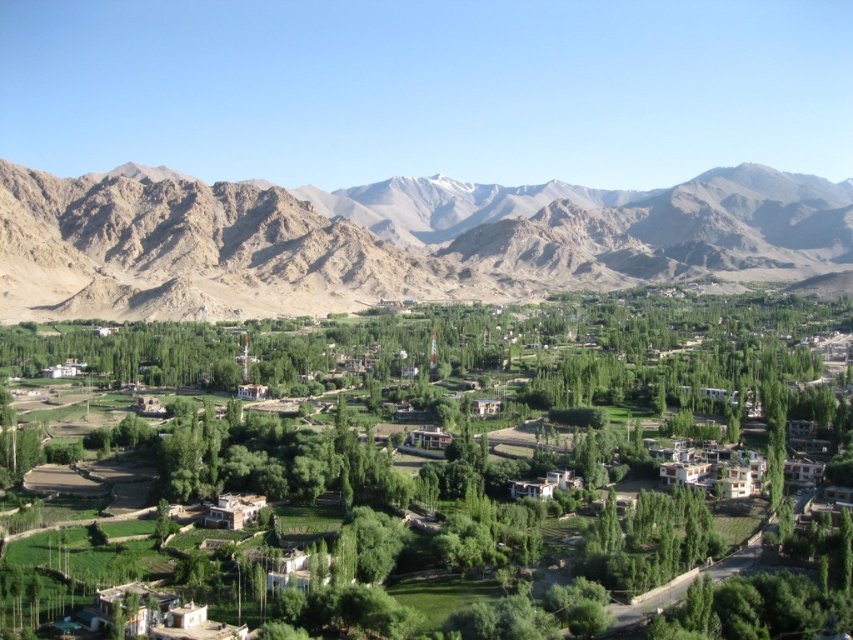
You are standing at the viewpoint overlooking the valley and notice two points marked in the scene. Which of the two points, point (619, 468) or point (519, 253), is closer to your current position?

Point (619, 468) is closer to the camera than point (519, 253).

You are standing in the valley and want to reach a specific location marked by the point at coordinates (715, 365). Given that your walking speed is 1.5 meters per second, approximately how many seconds will it take you to reach that point?

The point at coordinates (715, 365) is 268.70 meters away from the viewer. At a walking speed of 1.5 meters per second, it would take approximately 179 seconds to reach that point.